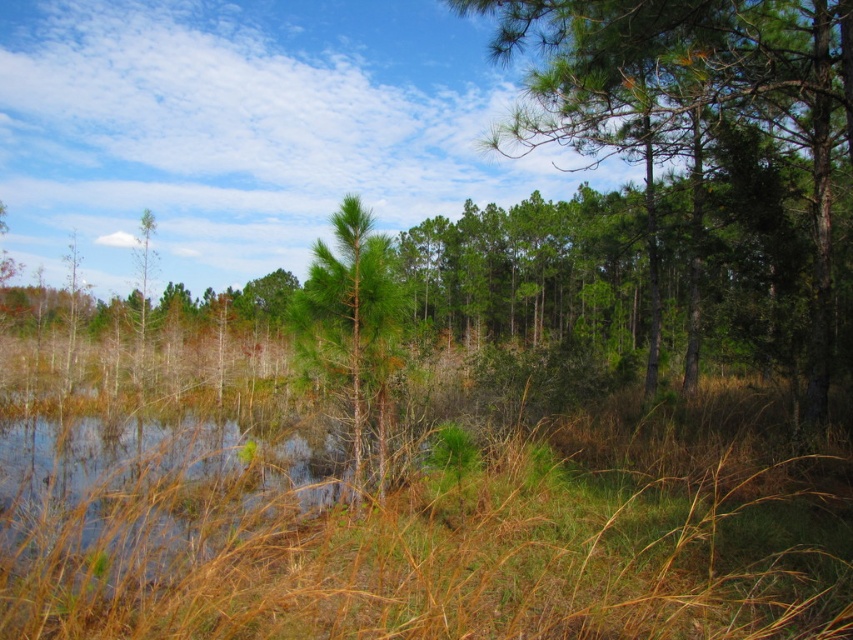
You are a hiker who wants to cross the small body of water but needs to stay within 50 feet of both the green leafy tree at center and the green matte tree at center. Is this possible?

The distance between the green leafy tree at center and the green matte tree at center is 40.69 feet. Since this distance is less than 50 feet, the hiker can cross the water while staying within the required range of both trees.

You are a bird looking for a nesting spot. You notice two trees at the center of the image, a green leafy tree at center and a green matte tree at center. Which tree would provide a more spacious nesting area?

The green leafy tree at center is larger in size than the green matte tree at center, so it would provide a more spacious nesting area.